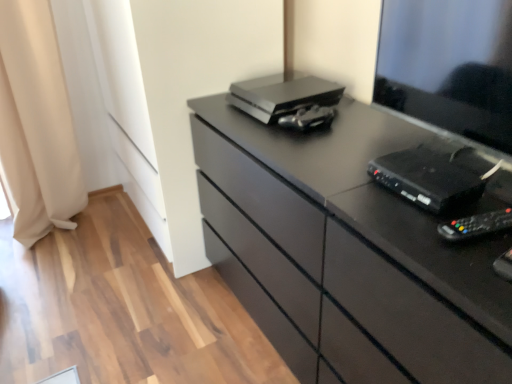
Identify the location of vacant region below beige fabric curtain at left (from a real-world perspective). The height and width of the screenshot is (384, 512). (86, 219).